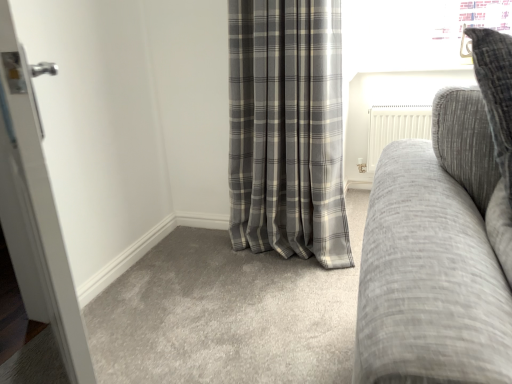
This screenshot has width=512, height=384. I want to click on textured gray couch at right, so click(443, 240).

Locate an element on the screen. This screenshot has height=384, width=512. white glossy door at left is located at coordinates (35, 210).

Considering the sizes of objects white glossy door at left and gray plaid curtain at center in the image provided, who is smaller, white glossy door at left or gray plaid curtain at center?

Smaller between the two is white glossy door at left.

From the picture: How far apart are white glossy door at left and gray plaid curtain at center?

white glossy door at left is 1.03 meters from gray plaid curtain at center.

Can you confirm if white glossy door at left is wider than gray plaid curtain at center?

Incorrect, the width of white glossy door at left does not surpass that of gray plaid curtain at center.

Considering the relative positions of white glossy door at left and gray plaid curtain at center in the image provided, is white glossy door at left to the left or to the right of gray plaid curtain at center?

In the image, white glossy door at left appears on the left side of gray plaid curtain at center.

In terms of width, does gray plaid curtain at center look wider or thinner when compared to white glossy door at left?

Considering their sizes, gray plaid curtain at center looks broader than white glossy door at left.

Could you tell me if gray plaid curtain at center is facing white glossy door at left?

Yes.

Is textured gray couch at right taller or shorter than gray plaid curtain at center?

textured gray couch at right is shorter than gray plaid curtain at center.

At what (x,y) coordinates should I click in order to perform the action: click on curtain directly beneath the textured gray couch at right (from a real-world perspective). Please return your answer as a coordinate pair (x, y). This screenshot has width=512, height=384. Looking at the image, I should click on pyautogui.click(x=287, y=130).

Is point (447, 144) closer or farther from the camera than point (259, 172)?

Clearly, point (447, 144) is closer to the camera than point (259, 172).

Is textured gray couch at right closer to camera compared to gray plaid curtain at center?

Yes, the depth of textured gray couch at right is less than that of gray plaid curtain at center.

Which object is positioned more to the left, white glossy door at left or textured gray couch at right?

white glossy door at left.

From the image's perspective, relative to textured gray couch at right, is white glossy door at left above or below?

Based on their image positions, white glossy door at left is located beneath textured gray couch at right.

Is white glossy door at left not within textured gray couch at right?

Indeed, white glossy door at left is completely outside textured gray couch at right.

Is white glossy door at left taller or shorter than textured gray couch at right?

white glossy door at left is taller than textured gray couch at right.

How many degrees apart are the facing directions of gray plaid curtain at center and textured gray couch at right?

The angular difference between gray plaid curtain at center and textured gray couch at right is 40.3 degrees.

Does gray plaid curtain at center have a smaller size compared to textured gray couch at right?

No.

Would you say textured gray couch at right is part of gray plaid curtain at center's contents?

No, textured gray couch at right is not inside gray plaid curtain at center.

Considering the relative sizes of textured gray couch at right and white glossy door at left in the image provided, is textured gray couch at right bigger than white glossy door at left?

Yes, textured gray couch at right is bigger than white glossy door at left.

Would you say textured gray couch at right is to the left or to the right of white glossy door at left in the picture?

From the image, it's evident that textured gray couch at right is to the right of white glossy door at left.

Consider the image. Does textured gray couch at right have a greater height compared to white glossy door at left?

Incorrect, the height of textured gray couch at right is not larger of that of white glossy door at left.

Would you say white glossy door at left is part of textured gray couch at right's contents?

No, white glossy door at left is located outside of textured gray couch at right.

Find the location of a particular element. This screenshot has height=384, width=512. door below the gray plaid curtain at center (from a real-world perspective) is located at coordinates (35, 210).

Where is `curtain above the white glossy door at left (from the image's perspective)`? The image size is (512, 384). curtain above the white glossy door at left (from the image's perspective) is located at coordinates (287, 130).

Looking at the image, which one is located closer to gray plaid curtain at center, textured gray couch at right or white glossy door at left?

Among the two, white glossy door at left is located nearer to gray plaid curtain at center.

Considering their positions, is white glossy door at left positioned closer to textured gray couch at right than gray plaid curtain at center?

white glossy door at left is closer to textured gray couch at right.

Looking at the image, which one is located further to gray plaid curtain at center, white glossy door at left or textured gray couch at right?

Among the two, textured gray couch at right is located further to gray plaid curtain at center.

Which object lies further to the anchor point textured gray couch at right, gray plaid curtain at center or white glossy door at left?

The object further to textured gray couch at right is gray plaid curtain at center.

Which object lies nearer to the anchor point white glossy door at left, textured gray couch at right or gray plaid curtain at center?

textured gray couch at right is closer to white glossy door at left.

From the image, which object appears to be nearer to white glossy door at left, gray plaid curtain at center or textured gray couch at right?

textured gray couch at right.

Identify the location of door positioned between textured gray couch at right and gray plaid curtain at center from near to far. Image resolution: width=512 pixels, height=384 pixels. (35, 210).